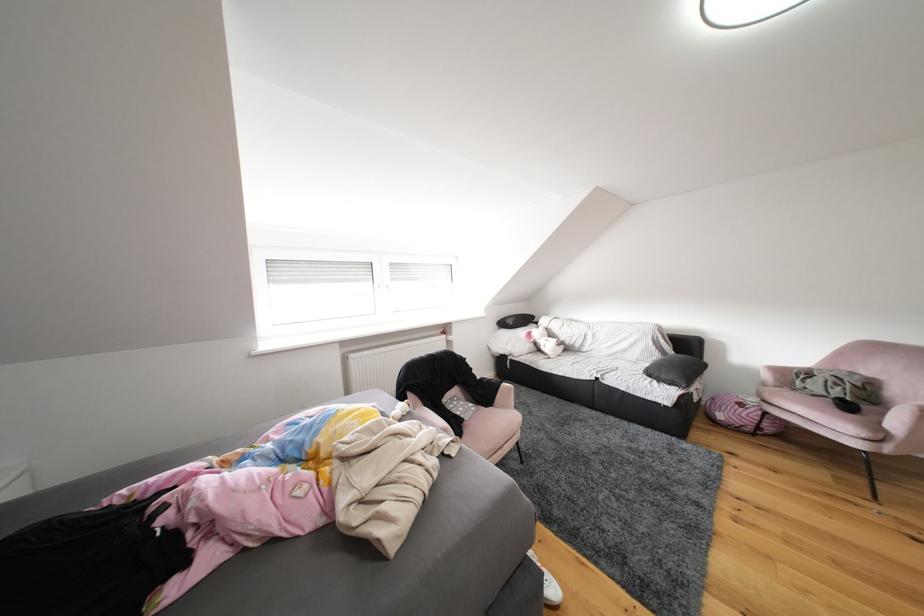
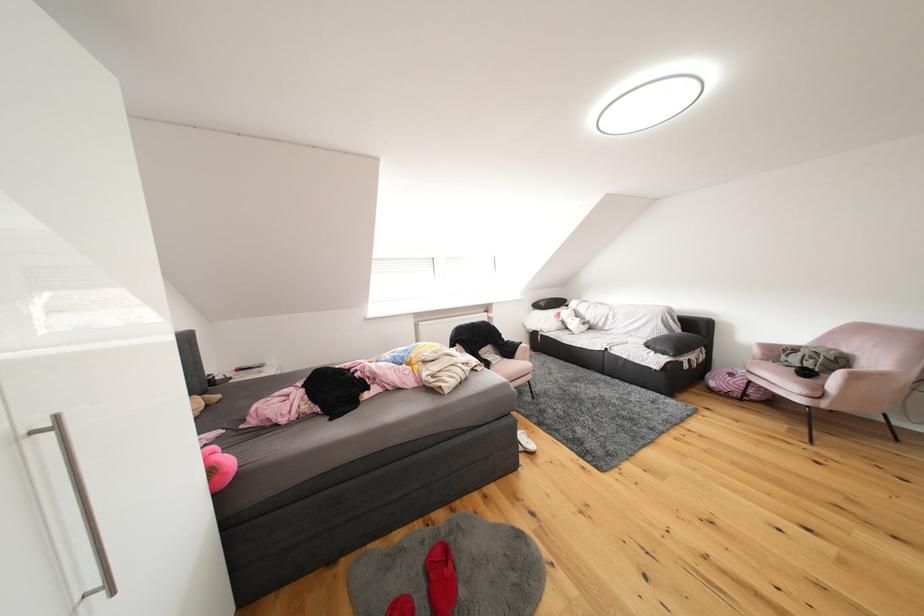
In the second image, find the point that corresponds to the point at 775,379 in the first image.

(766, 355)